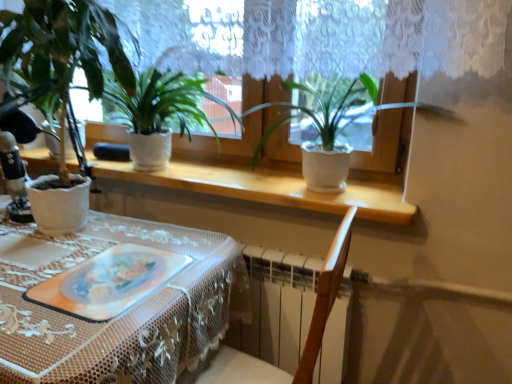
Question: Considering the relative positions of white lace tablecloth at lower left and white matte pot at center, acting as the 1th houseplant starting from the right, in the image provided, is white lace tablecloth at lower left behind white matte pot at center, acting as the 1th houseplant starting from the right,?

Choices:
 (A) yes
 (B) no

Answer: (B)

Question: Considering the relative sizes of white lace tablecloth at lower left and white matte pot at center, acting as the 1th houseplant starting from the right, in the image provided, is white lace tablecloth at lower left taller than white matte pot at center, acting as the 1th houseplant starting from the right,?

Choices:
 (A) no
 (B) yes

Answer: (B)

Question: Does white lace tablecloth at lower left have a larger size compared to white matte pot at center, the third houseplant positioned from the left?

Choices:
 (A) no
 (B) yes

Answer: (B)

Question: Does white lace tablecloth at lower left appear on the left side of white matte pot at center, acting as the 1th houseplant starting from the right?

Choices:
 (A) yes
 (B) no

Answer: (A)

Question: From a real-world perspective, is white lace tablecloth at lower left beneath white matte pot at center, acting as the 1th houseplant starting from the right?

Choices:
 (A) no
 (B) yes

Answer: (B)

Question: Is translucent plastic platter at center wider or thinner than matte white pot at center, which is the 2th houseplant from right to left?

Choices:
 (A) thin
 (B) wide

Answer: (B)

Question: From a real-world perspective, is translucent plastic platter at center positioned above or below matte white pot at center, which is the 2th houseplant from right to left?

Choices:
 (A) above
 (B) below

Answer: (B)

Question: Is point (165, 261) closer or farther from the camera than point (116, 87)?

Choices:
 (A) closer
 (B) farther

Answer: (A)

Question: Is translucent plastic platter at center spatially inside matte white pot at center, which is the 2th houseplant from right to left, or outside of it?

Choices:
 (A) inside
 (B) outside

Answer: (B)

Question: Visually, is matte white pot at center, placed as the second houseplant when sorted from left to right, positioned to the left or to the right of white matte pot at center, acting as the 1th houseplant starting from the right?

Choices:
 (A) right
 (B) left

Answer: (B)

Question: Which is correct: matte white pot at center, which is the 2th houseplant from right to left, is inside white matte pot at center, the third houseplant positioned from the left, or outside of it?

Choices:
 (A) inside
 (B) outside

Answer: (B)

Question: Considering the positions of point (195, 79) and point (329, 165), is point (195, 79) closer or farther from the camera than point (329, 165)?

Choices:
 (A) farther
 (B) closer

Answer: (A)

Question: From the image's perspective, is matte white pot at center, which is the 2th houseplant from right to left, positioned above or below white matte pot at center, acting as the 1th houseplant starting from the right?

Choices:
 (A) below
 (B) above

Answer: (B)

Question: Based on their positions, is white textured pot at left, arranged as the 3th houseplant when viewed from the right, located to the left or right of translucent plastic platter at center?

Choices:
 (A) right
 (B) left

Answer: (B)

Question: Relative to translucent plastic platter at center, is white textured pot at left, the 1th houseplant in the left-to-right sequence, in front or behind?

Choices:
 (A) front
 (B) behind

Answer: (A)